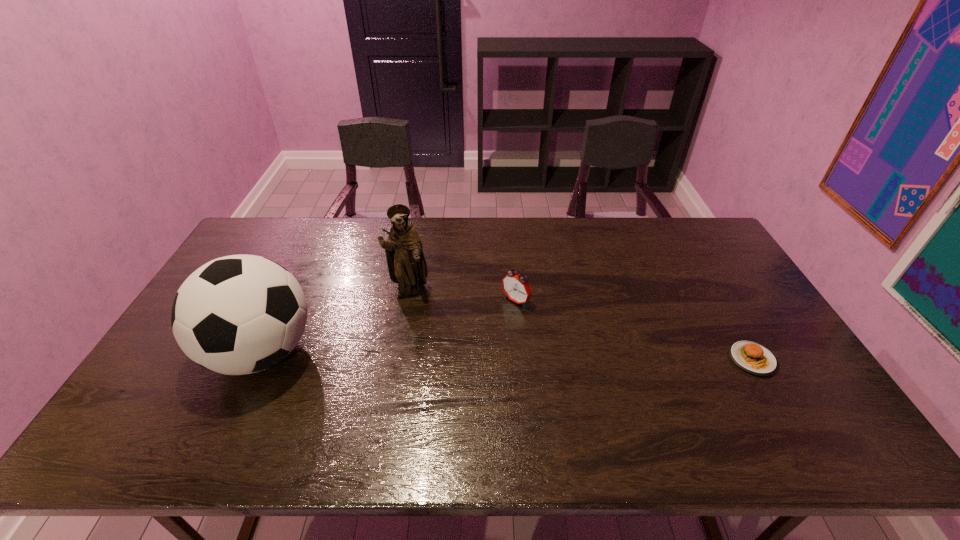
You are a GUI agent. You are given a task and a screenshot of the screen. Output one action in this format:
    pyautogui.click(x=<x>, y=<y>)
    Task: Click on the vacant spot on the desktop that is between the leftmost object and the food and is positioned on the clock face of the alarm clock
    
    Given the screenshot: What is the action you would take?
    pyautogui.click(x=455, y=355)

I want to click on free space on the desktop that is between the leftmost object and the shortest object and is positioned on the front-facing side of the figurine, so click(x=450, y=355).